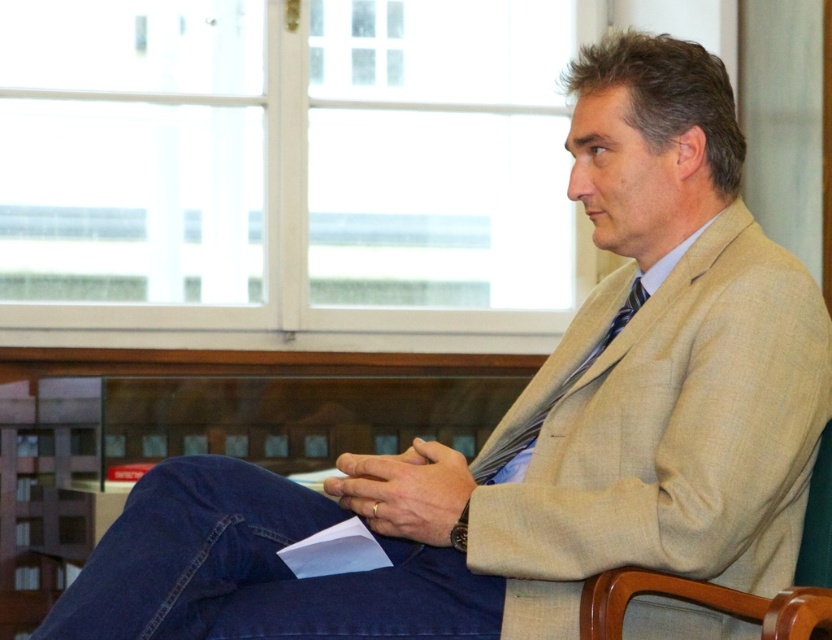
Question: Does light brown wood chair at center appear on the right side of silky blue tie at center?

Choices:
 (A) no
 (B) yes

Answer: (B)

Question: Does light brown wood chair at center come behind silky blue tie at center?

Choices:
 (A) yes
 (B) no

Answer: (B)

Question: Which of the following is the closest to the observer?

Choices:
 (A) (627, 301)
 (B) (631, 588)

Answer: (B)

Question: Which point is closer to the camera?

Choices:
 (A) (617, 321)
 (B) (618, 625)

Answer: (B)

Question: Can you confirm if light brown wood chair at center is positioned to the left of silky blue tie at center?

Choices:
 (A) yes
 (B) no

Answer: (B)